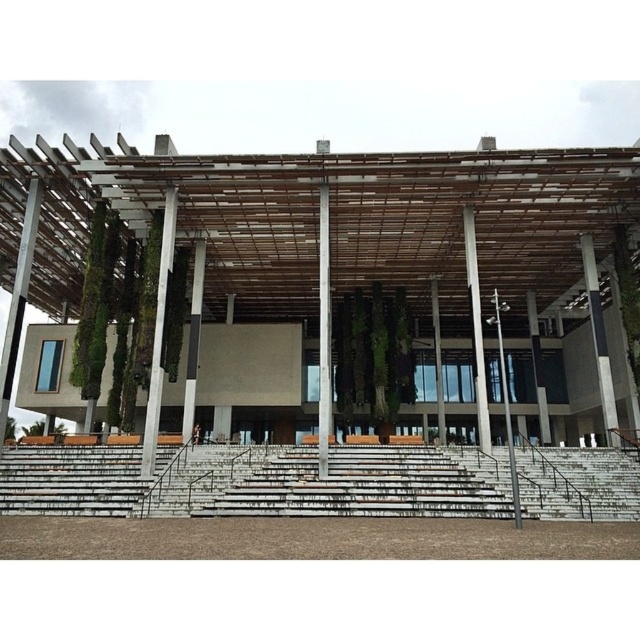
Between wooden lattice structure at center and smooth concrete pillar at center, which one has less height?

smooth concrete pillar at center

Is point (198, 339) more distant than point (188, 435)?

Yes, it is.

Is point (340, 177) positioned after point (193, 342)?

No, (340, 177) is in front of (193, 342).

In order to click on wooden lattice structure at center in this screenshot , I will do `click(348, 321)`.

Based on the photo, is green mossy pillar at center thinner than white concrete pillar at center?

Yes.

Describe the element at coordinates (157, 333) in the screenshot. The image size is (640, 640). I see `green mossy pillar at center` at that location.

Locate an element on the screen. Image resolution: width=640 pixels, height=640 pixels. green mossy pillar at center is located at coordinates (157, 333).

Can you confirm if white concrete pillar at center is positioned to the left of smooth concrete pillar at center?

Incorrect, white concrete pillar at center is not on the left side of smooth concrete pillar at center.

Does white concrete pillar at center appear over smooth concrete pillar at center?

No, white concrete pillar at center is not above smooth concrete pillar at center.

Where is `white concrete pillar at center`? white concrete pillar at center is located at coordinates (476, 330).

Locate an element on the screen. white concrete pillar at center is located at coordinates (476, 330).